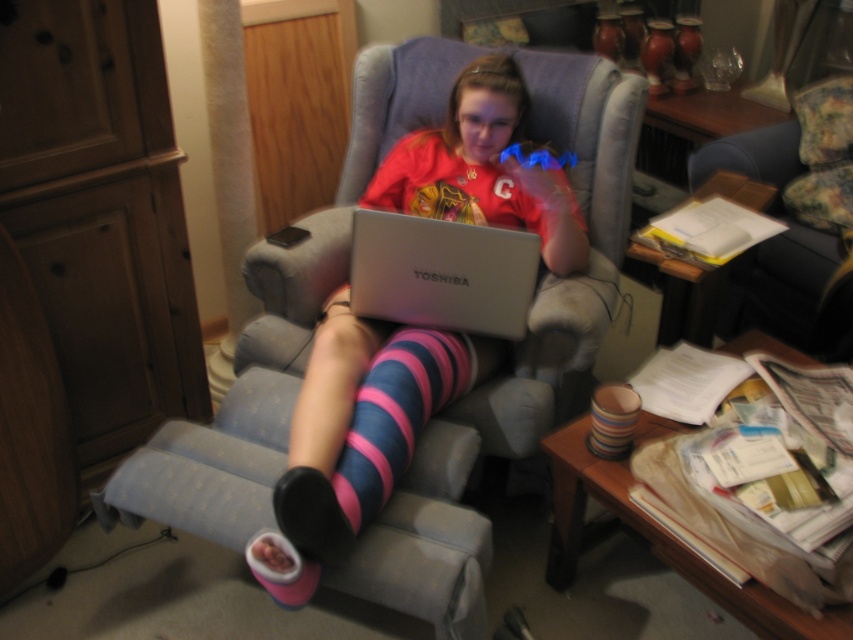
Does pink striped socks at center have a greater height compared to pink striped sock at center?

Yes.

Which is more to the left, pink striped socks at center or pink striped sock at center?

pink striped socks at center is more to the left.

Who is more distant from viewer, [370,449] or [410,403]?

Positioned behind is point [410,403].

Locate an element on the screen. The width and height of the screenshot is (853, 640). pink striped socks at center is located at coordinates (358, 429).

Is pink striped socks at center positioned in front of silver metallic laptop at center?

Yes, it is in front of silver metallic laptop at center.

Who is higher up, pink striped socks at center or silver metallic laptop at center?

silver metallic laptop at center

Describe the element at coordinates (358, 429) in the screenshot. This screenshot has width=853, height=640. I see `pink striped socks at center` at that location.

Image resolution: width=853 pixels, height=640 pixels. I want to click on pink striped socks at center, so click(358, 429).

Describe the element at coordinates (440, 273) in the screenshot. The width and height of the screenshot is (853, 640). I see `silver metallic laptop at center` at that location.

Find the location of a particular element. silver metallic laptop at center is located at coordinates (440, 273).

The height and width of the screenshot is (640, 853). Find the location of `silver metallic laptop at center`. silver metallic laptop at center is located at coordinates (440, 273).